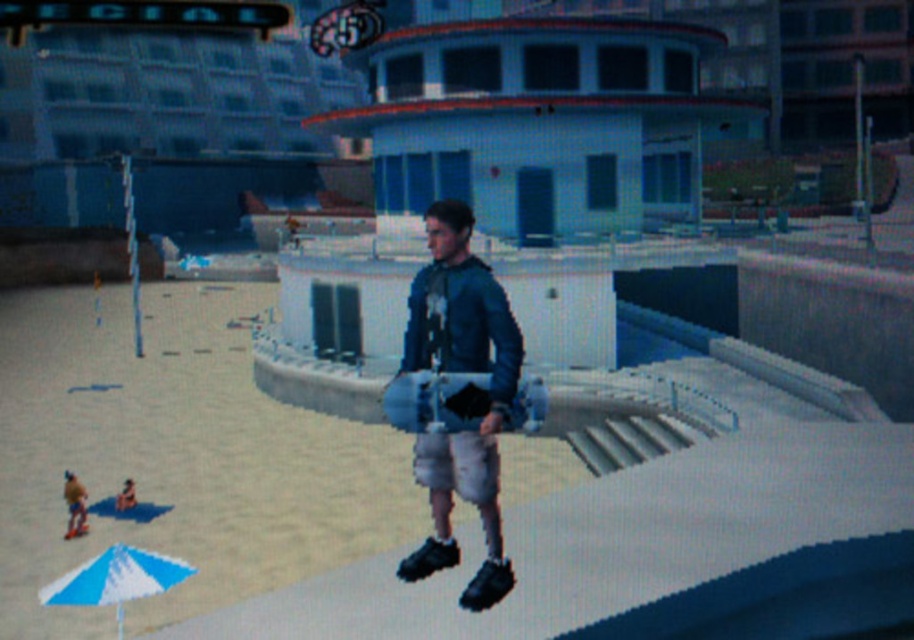
You are standing at the edge of the pool area in the game scene. You need to retrieve the blue and white striped umbrella at lower left. If your character can jump a maximum distance of 30 feet, can you reach the umbrella in one jump?

The blue and white striped umbrella at lower left and viewer are 42.63 feet apart. Since your character can only jump 30 feet, you cannot reach the umbrella in one jump.

You are a character in the game and need to pick up the matte gray skateboard at center and the light brown fabric shorts at lower left. Which object should you move towards first if you want to collect both items efficiently?

You should move towards the light brown fabric shorts at lower left first because the matte gray skateboard at center is to the right of it, so picking up the shorts first allows you to collect both items efficiently by moving in one direction.